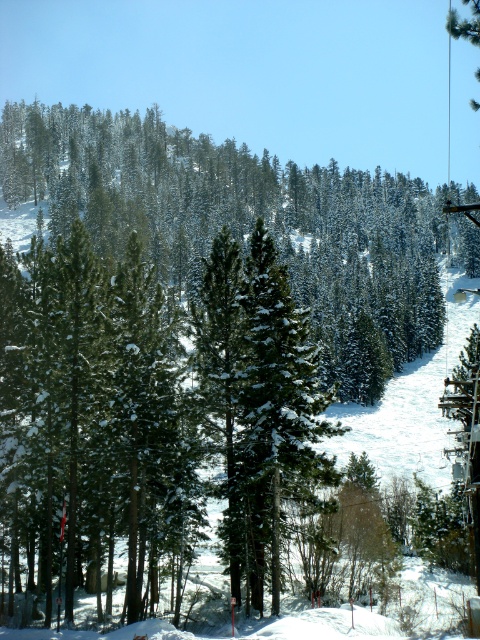
You are a hiker planning to navigate through the winter forest. You see the green textured pine at center. Based on its position, can you estimate how far it is from the center of the image?

The green textured pine at center is located at point 0.350 on the x axis and 0.510 on the y axis, so it is slightly to the left and below the exact center of the image.

You are a photographer planning to capture the winter landscape. You notice the green textured pine at center and the green matte tree at center. Which tree should you focus on if you want to highlight a larger subject in your photo?

The green textured pine at center is bigger than the green matte tree at center, so focusing on the green textured pine at center will highlight a larger subject in your photo.